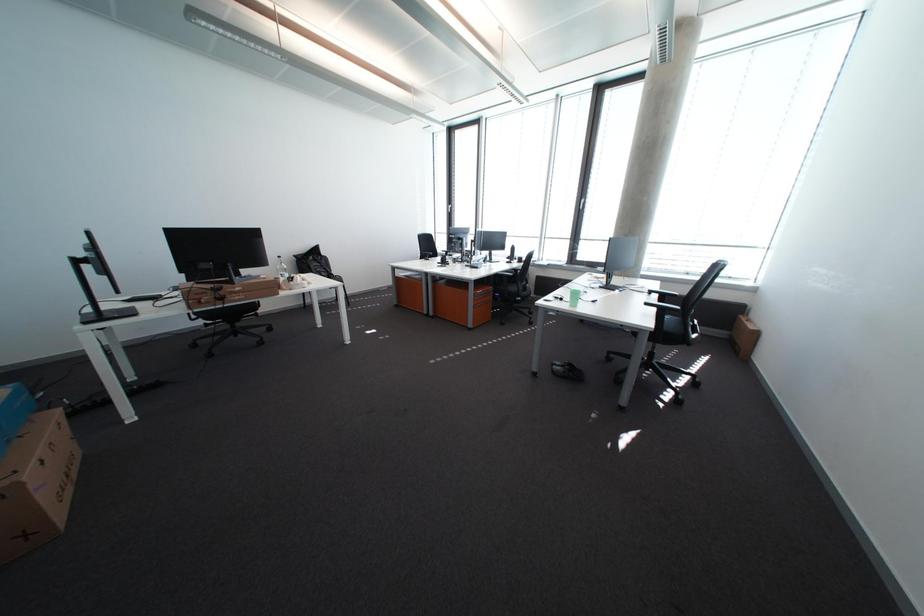
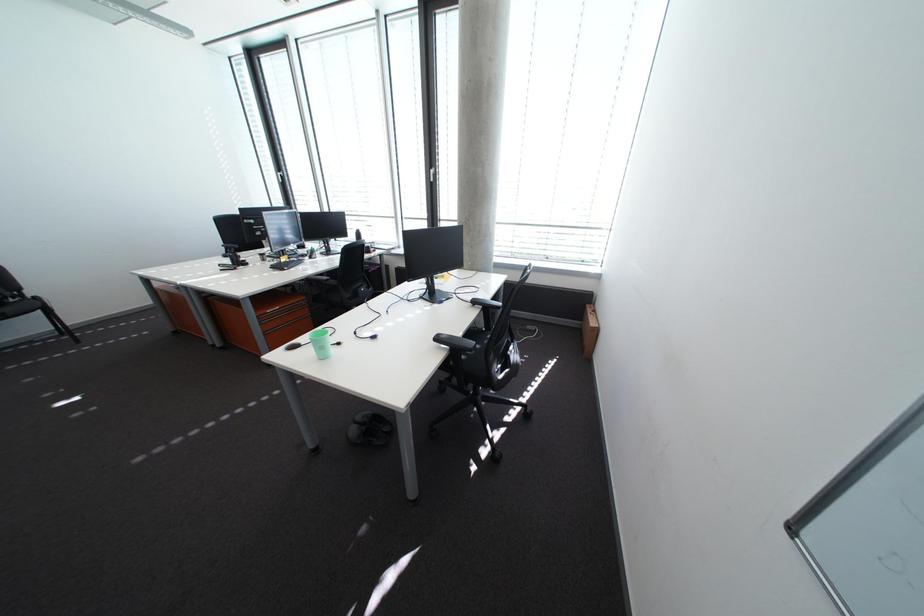
The images are taken continuously from a first-person perspective. In which direction are you moving?

The cameraman moved toward right, forward.